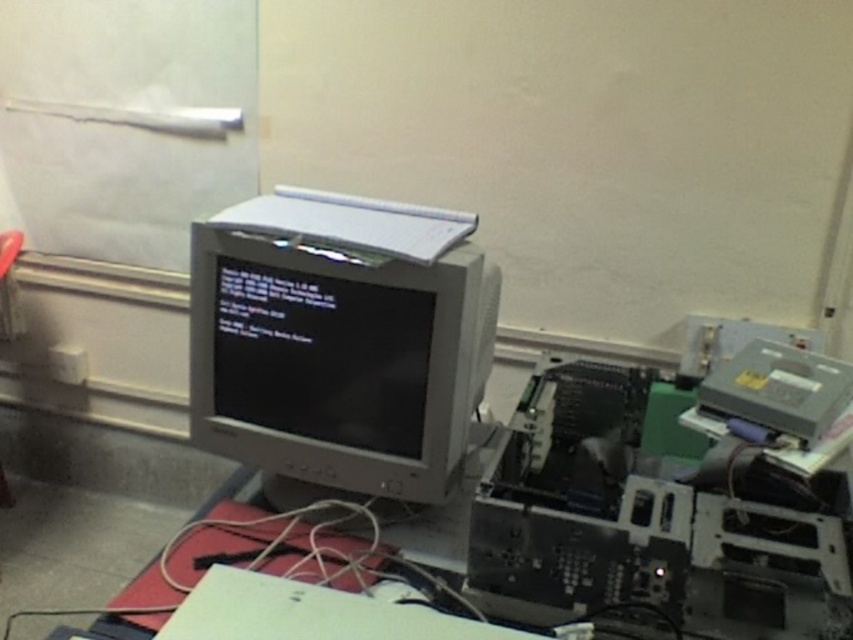
You are a technician trying to reach a specific point in the workspace. The point you need to reach is labeled as point [247,390]. Given that your arm can extend 1.3 meters, can you reach it?

The point [247,390] is 1.38 meters away from the camera, so your arm can only extend 1.3 meters, meaning you cannot reach it.

You are setting up a new cable connection between the matte gray monitor at center and the gray plastic printer at right. The cable you have is 50 centimeters long. Will it be long enough to connect them without needing an extension?

The distance between the matte gray monitor at center and the gray plastic printer at right is 56.41 centimeters. Since the cable is only 50 centimeters long, it will not be long enough to connect them without needing an extension.